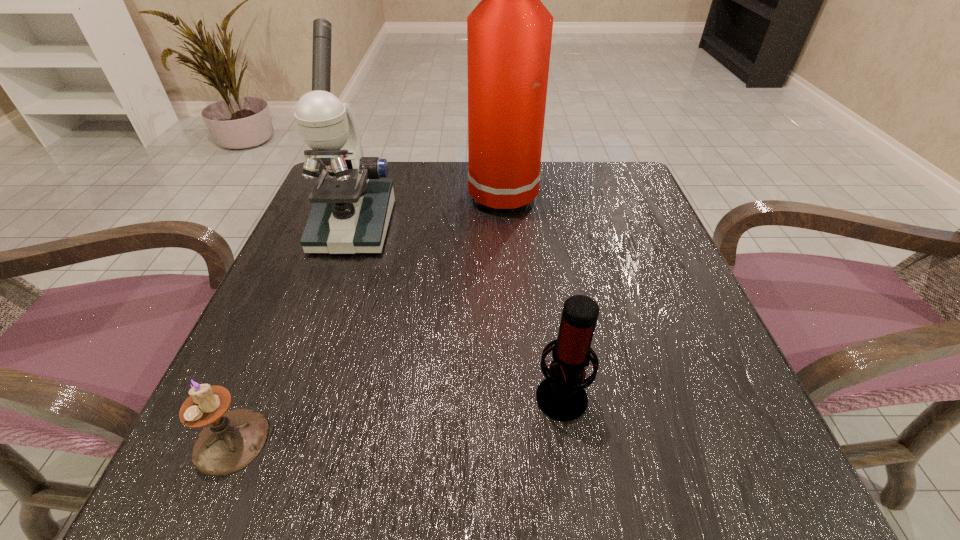
You are a GUI agent. You are given a task and a screenshot of the screen. Output one action in this format:
    pyautogui.click(x=<x>, y=<y>)
    Task: Click on the unoccupied position between the microscope and the candle holder
    This screenshot has width=960, height=540.
    Given the screenshot: What is the action you would take?
    pyautogui.click(x=293, y=334)

Locate an element on the screen. Image resolution: width=960 pixels, height=540 pixels. free area in between the microscope and the fire extinguisher is located at coordinates (435, 211).

This screenshot has height=540, width=960. Identify the location of vacant space that's between the candle holder and the microphone. tap(396, 417).

Find the location of a particular element. The width and height of the screenshot is (960, 540). empty space between the microscope and the fire extinguisher is located at coordinates (435, 211).

Where is `object that stands as the second closest to the shortest object`? The width and height of the screenshot is (960, 540). object that stands as the second closest to the shortest object is located at coordinates (562, 397).

What are the coordinates of `object that is the second closest one to the third shortest object` in the screenshot? It's located at (231, 440).

Identify the location of free space that satisfies the following two spatial constraints: 1. at the nozzle of the tallest object; 2. on the front side of the third shortest object. (521, 226).

Identify the location of vacant space that satisfies the following two spatial constraints: 1. on the front side of the third shortest object; 2. on the right side of the second shortest object. (295, 394).

At what (x,y) coordinates should I click in order to perform the action: click on vacant space that satisfies the following two spatial constraints: 1. on the back side of the shortest object; 2. on the right side of the third tallest object. Please return your answer as a coordinate pair (x, y). The image size is (960, 540). Looking at the image, I should click on (252, 394).

Image resolution: width=960 pixels, height=540 pixels. Find the location of `free region that satisfies the following two spatial constraints: 1. at the nozzle of the tallest object; 2. on the front side of the candle holder`. free region that satisfies the following two spatial constraints: 1. at the nozzle of the tallest object; 2. on the front side of the candle holder is located at coordinates (545, 441).